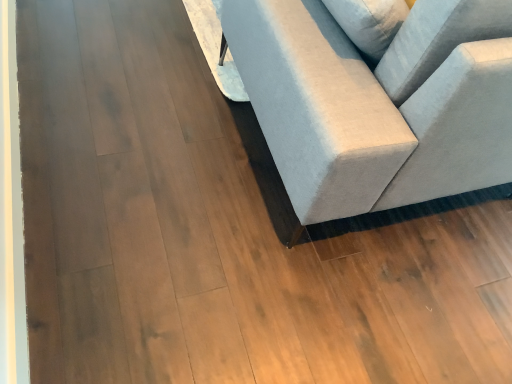
What are the coordinates of `free location in front of light gray fabric couch at lower right` in the screenshot? It's located at (268, 269).